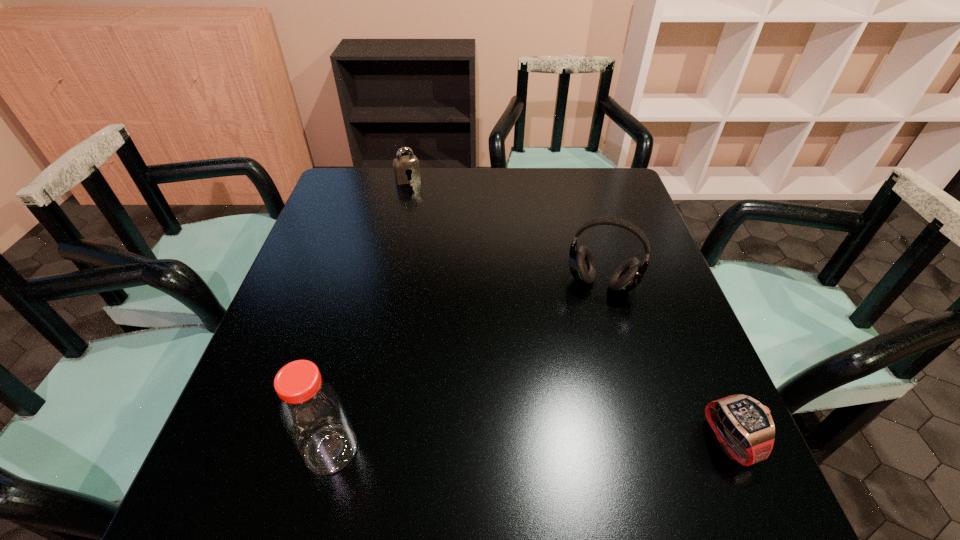
You are a GUI agent. You are given a task and a screenshot of the screen. Output one action in this format:
    pyautogui.click(x=<x>, y=<y>)
    Task: Click on the bottle
    This screenshot has height=540, width=960.
    Given the screenshot: What is the action you would take?
    pyautogui.click(x=312, y=412)

In order to click on the rightmost object in this screenshot , I will do `click(744, 427)`.

Find the location of `the shortest object`. the shortest object is located at coordinates (744, 427).

In order to click on the third object from left to right in this screenshot , I will do `click(628, 275)`.

This screenshot has height=540, width=960. I want to click on headset, so click(628, 275).

Image resolution: width=960 pixels, height=540 pixels. What are the coordinates of `the farthest object` in the screenshot? It's located at (406, 167).

This screenshot has height=540, width=960. What are the coordinates of `the third tallest object` in the screenshot? It's located at pyautogui.click(x=406, y=167).

Locate an element on the screen. This screenshot has width=960, height=540. free space located on the left of the bottle is located at coordinates (249, 449).

This screenshot has width=960, height=540. Find the location of `vacant region located on the back of the shortest object`. vacant region located on the back of the shortest object is located at coordinates (681, 325).

Identify the location of blank area located 0.050m on the ear cups of the headset. The image size is (960, 540). (588, 316).